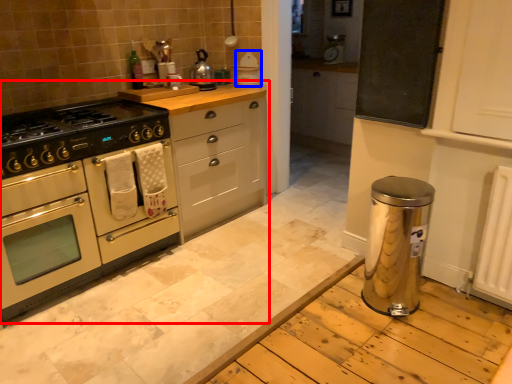
Question: Which object appears farthest to the camera in this image, cabinetry (highlighted by a red box) or appliance (highlighted by a blue box)?

Choices:
 (A) cabinetry
 (B) appliance

Answer: (B)